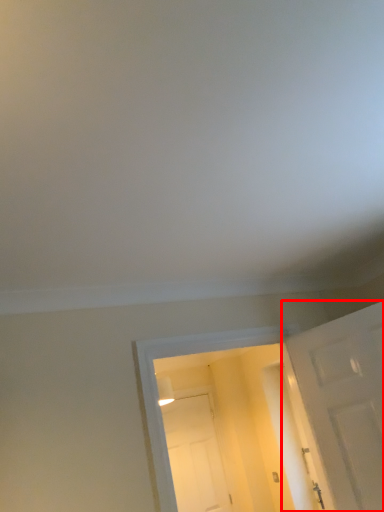
Question: From the image's perspective, what is the correct spatial positioning of door (annotated by the red box) in reference to door?

Choices:
 (A) below
 (B) above

Answer: (B)